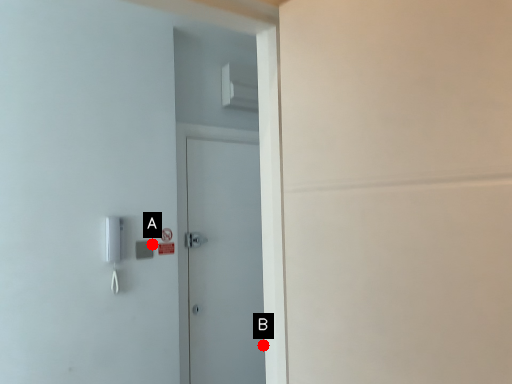
Question: Two points are circled on the image, labeled by A and B beside each circle. Which point is closer to the camera?

Choices:
 (A) A is closer
 (B) B is closer

Answer: (A)